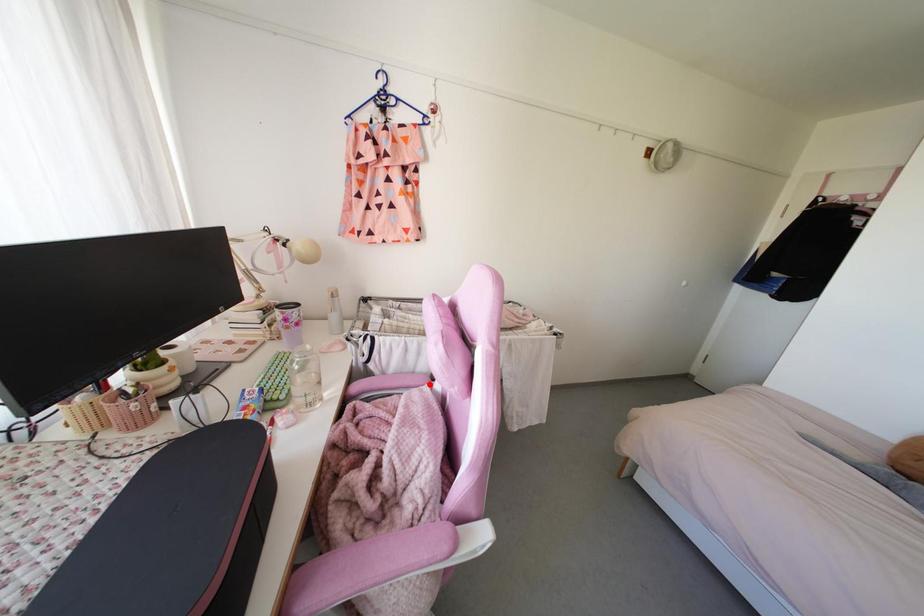
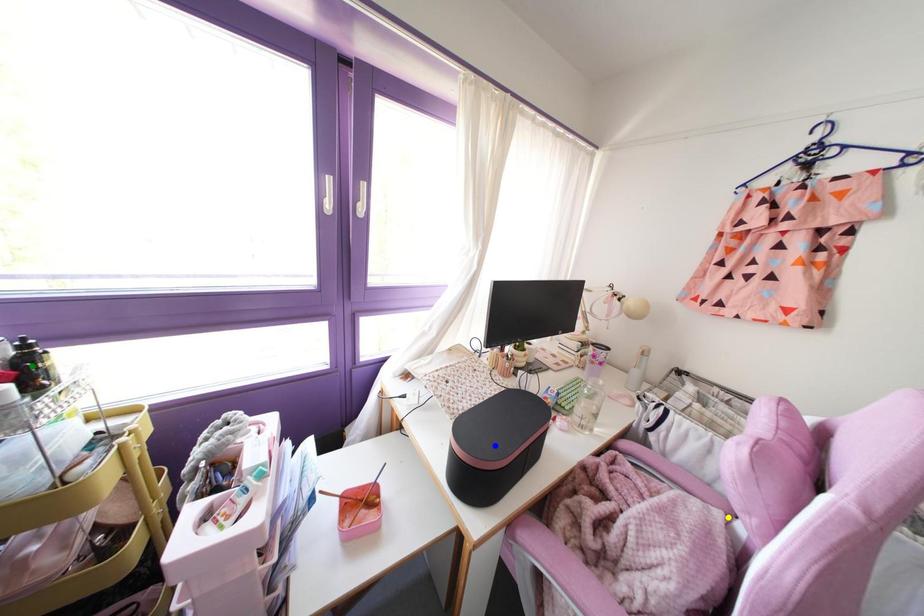
Question: I am providing you with two images of the same scene from different viewpoints. A red point is marked on the first image. You are given multiple points on the second image. Which point in image 2 represents the same 3d spot as the red point in image 1?

Choices:
 (A) green point
 (B) blue point
 (C) yellow point

Answer: (C)